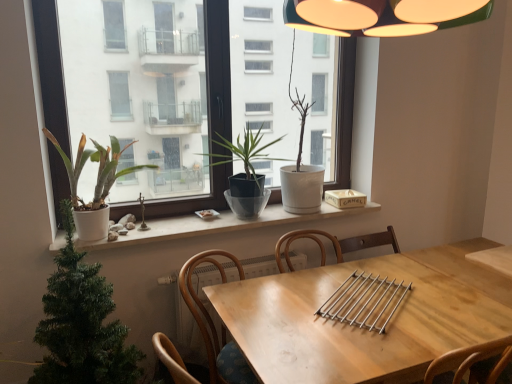
Question: From the image's perspective, would you say matte white window at center is positioned over white matte window sill at center?

Choices:
 (A) no
 (B) yes

Answer: (B)

Question: Is the surface of matte white window at center in direct contact with white matte window sill at center?

Choices:
 (A) no
 (B) yes

Answer: (A)

Question: Is white matte window sill at center located within matte white window at center?

Choices:
 (A) no
 (B) yes

Answer: (A)

Question: Is matte white window at center wider than white matte window sill at center?

Choices:
 (A) no
 (B) yes

Answer: (A)

Question: Does matte white window at center appear on the right side of white matte window sill at center?

Choices:
 (A) yes
 (B) no

Answer: (B)

Question: From the image's perspective, is matte white window at center beneath white matte window sill at center?

Choices:
 (A) no
 (B) yes

Answer: (A)

Question: Are matte gray pot at center, which is the 2th houseplant in right-to-left order, and wooden at center making contact?

Choices:
 (A) yes
 (B) no

Answer: (B)

Question: Does matte gray pot at center, which is the 2th houseplant in right-to-left order, have a smaller size compared to wooden at center?

Choices:
 (A) yes
 (B) no

Answer: (A)

Question: Could you tell me if matte gray pot at center, the 3th houseplant viewed from the left, is turned towards wooden at center?

Choices:
 (A) yes
 (B) no

Answer: (B)

Question: Is matte gray pot at center, the 3th houseplant viewed from the left, further to camera compared to wooden at center?

Choices:
 (A) no
 (B) yes

Answer: (B)

Question: From the image's perspective, would you say matte gray pot at center, which is the 2th houseplant in right-to-left order, is shown under wooden at center?

Choices:
 (A) yes
 (B) no

Answer: (B)

Question: Can we say matte gray pot at center, the 3th houseplant viewed from the left, lies outside wooden at center?

Choices:
 (A) no
 (B) yes

Answer: (B)

Question: Can you confirm if white matte window sill at center is thinner than white matte pot at left, the first houseplant viewed from the left?

Choices:
 (A) no
 (B) yes

Answer: (B)